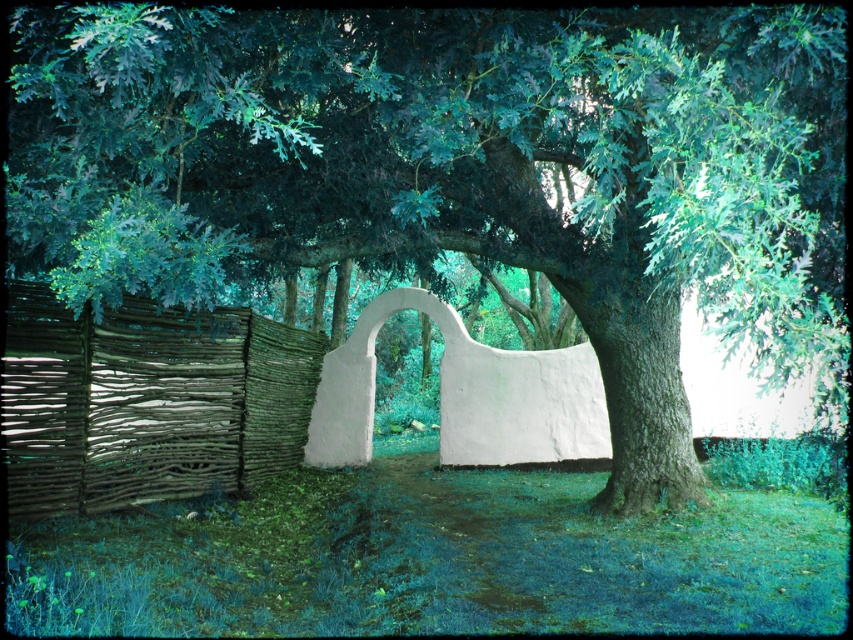
Question: Which of the following is the closest to the observer?

Choices:
 (A) brown woven fence at left
 (B) white matte archway at center

Answer: (A)

Question: Which object appears farthest from the camera in this image?

Choices:
 (A) white matte archway at center
 (B) brown woven fence at left

Answer: (A)

Question: Does brown woven fence at left have a greater width compared to white matte archway at center?

Choices:
 (A) no
 (B) yes

Answer: (A)

Question: Does brown woven fence at left have a larger size compared to white matte archway at center?

Choices:
 (A) no
 (B) yes

Answer: (B)

Question: Can you confirm if brown woven fence at left is thinner than white matte archway at center?

Choices:
 (A) no
 (B) yes

Answer: (B)